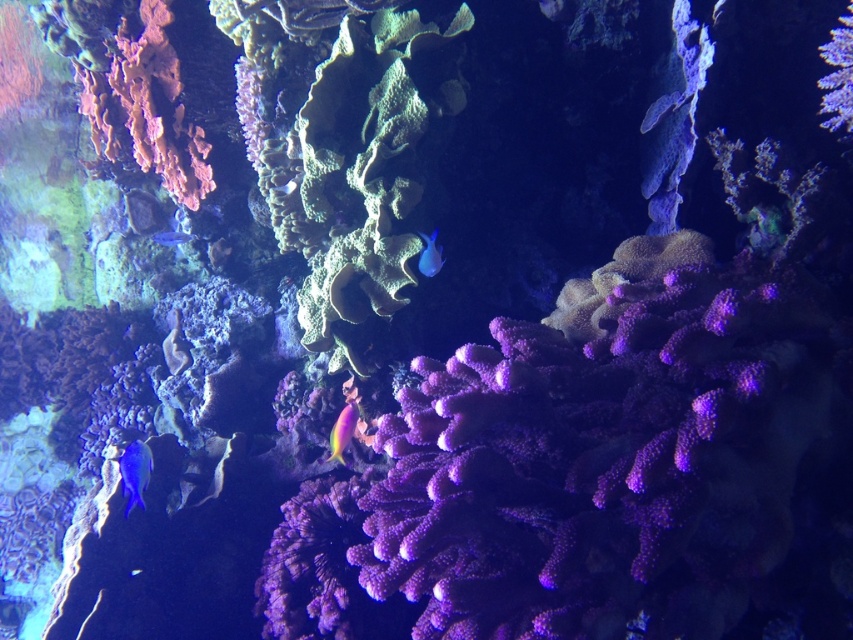
You are a marine biologist observing this underwater scene. You notice two blue fish, the matte blue fish at lower left and the shiny blue fish at upper right. Which fish is wider?

The matte blue fish at lower left is wider than the shiny blue fish at upper right.

You are a scuba diver swimming towards the shiny pink coral at center and the blue glossy fish at left. Which object will you reach first?

You will reach the shiny pink coral at center first because it is closer to you than the blue glossy fish at left.

You are a marine biologist observing this underwater scene. You need to place a 2.5 meter long measuring tape between the shiny blue fish at upper right and the blue glossy fish at left. Will the measuring tape be long enough to reach both ends?

The distance between the shiny blue fish at upper right and the blue glossy fish at left is 2.40 meters. The 2.5 meter measuring tape is slightly longer than the distance, so it will be long enough to reach both ends.